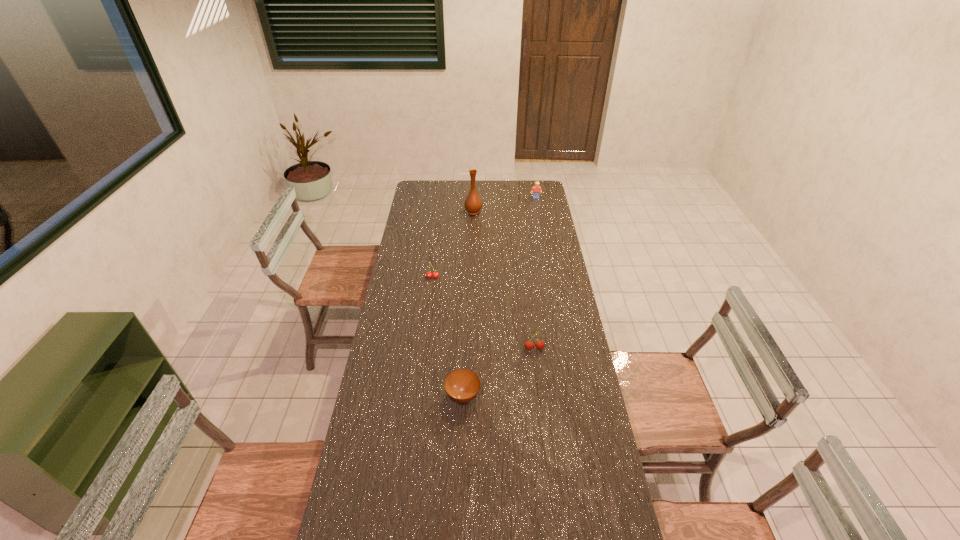
This screenshot has width=960, height=540. What are the coordinates of `the tallest object` in the screenshot? It's located at (473, 204).

Identify the location of vase. tap(473, 204).

Identify the location of the rightmost object. (536, 189).

At what (x,y) coordinates should I click in order to perform the action: click on Lego. Please return your answer as a coordinate pair (x, y). This screenshot has width=960, height=540. Looking at the image, I should click on (536, 189).

At what (x,y) coordinates should I click in order to perform the action: click on the fourth object from left to right. Please return your answer as a coordinate pair (x, y). The height and width of the screenshot is (540, 960). Looking at the image, I should click on (529, 345).

Identify the location of the second nearest object. This screenshot has height=540, width=960. (529, 345).

This screenshot has height=540, width=960. In order to click on the left cherry in this screenshot , I will do `click(435, 275)`.

The width and height of the screenshot is (960, 540). I want to click on the third farthest object, so click(435, 275).

Image resolution: width=960 pixels, height=540 pixels. Find the location of `bowl`. bowl is located at coordinates (462, 385).

In order to click on the shortest object in this screenshot , I will do pos(462,385).